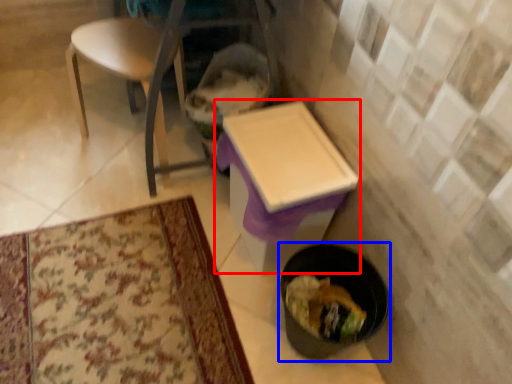
Question: Which point is further to the camera, table (highlighted by a red box) or potty (highlighted by a blue box)?

Choices:
 (A) table
 (B) potty

Answer: (A)